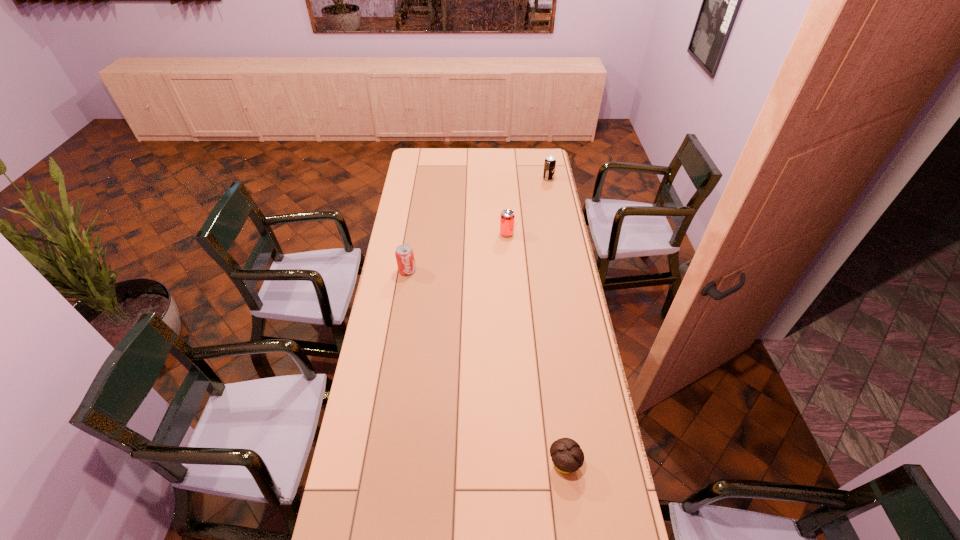
Locate an element on the screen. Image resolution: width=960 pixels, height=540 pixels. free space in the image that satisfies the following two spatial constraints: 1. on the back side of the nearest object; 2. on the left side of the rightmost soda can is located at coordinates (527, 179).

Locate an element on the screen. Image resolution: width=960 pixels, height=540 pixels. free space in the image that satisfies the following two spatial constraints: 1. on the back side of the farthest soda can; 2. on the left side of the leftmost object is located at coordinates (422, 179).